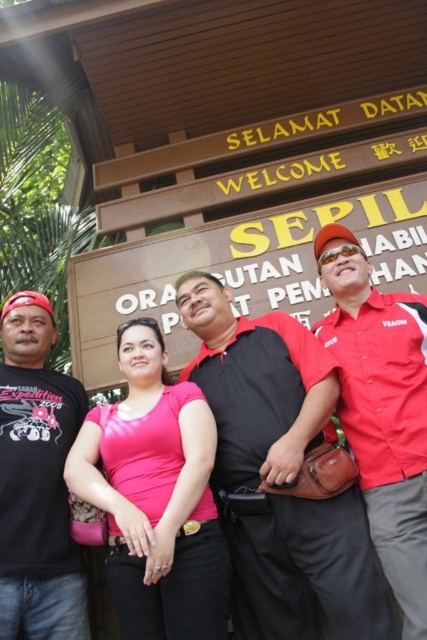
Can you confirm if pink matte shirt at center is wider than matte black t-shirt at left?

Indeed, pink matte shirt at center has a greater width compared to matte black t-shirt at left.

Is point (122, 586) farther from viewer compared to point (53, 433)?

No, (122, 586) is closer to viewer.

Identify the location of pink matte shirt at center. Image resolution: width=427 pixels, height=640 pixels. (155, 497).

Can you confirm if black smooth shirt at center is positioned above matte black t-shirt at left?

Yes, black smooth shirt at center is above matte black t-shirt at left.

Who is more forward, [332,508] or [76,582]?

Point [332,508]

Where is `black smooth shirt at center`? This screenshot has height=640, width=427. black smooth shirt at center is located at coordinates (280, 476).

Is point (193, 412) more distant than point (99, 273)?

No, it is in front of (99, 273).

Which is behind, point (149, 349) or point (423, 289)?

The point (423, 289) is behind.

Where is `pink matte shirt at center`? pink matte shirt at center is located at coordinates (155, 497).